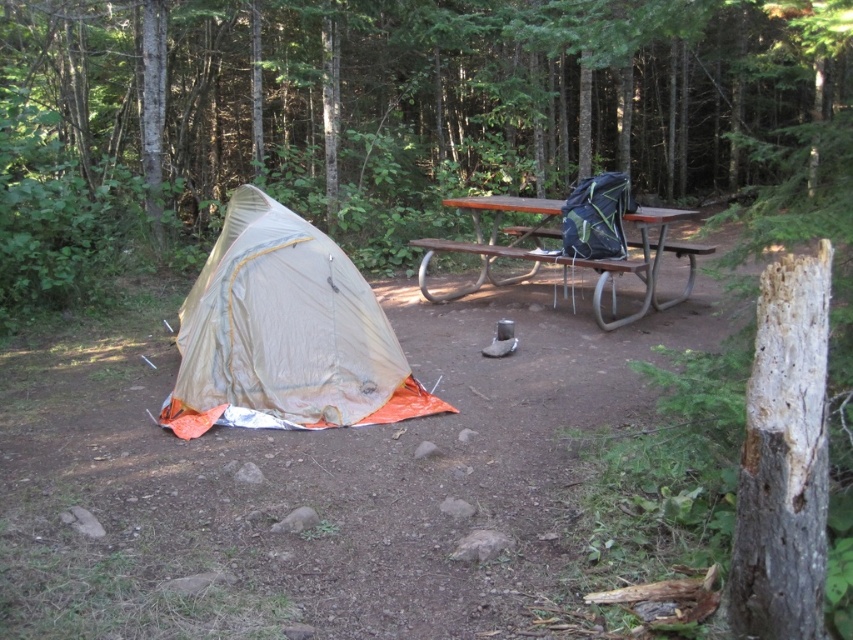
You are a camper who needs to move your gear from the smooth bark tree at center to the brown wooden picnic table at center. How far apart are these two objects?

The smooth bark tree at center and brown wooden picnic table at center are 12.28 feet apart from each other.